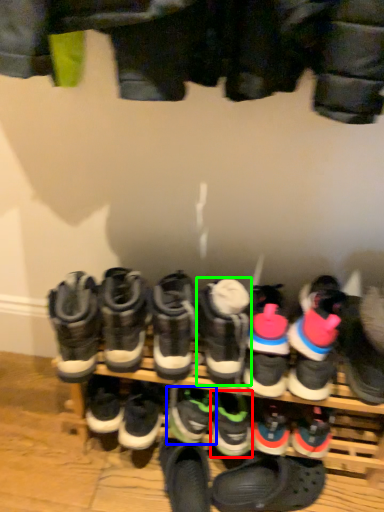
Question: Which is nearer to the footwear (highlighted by a red box)? footwear (highlighted by a blue box) or footwear (highlighted by a green box).

Choices:
 (A) footwear
 (B) footwear

Answer: (A)